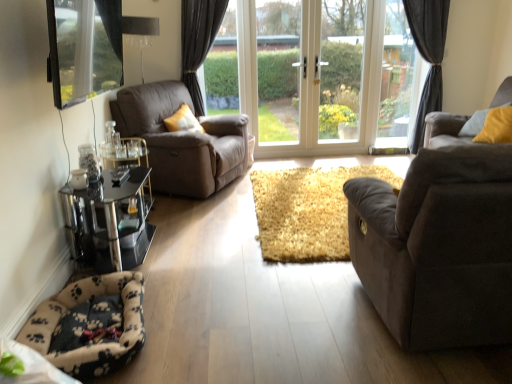
Question: From a real-world perspective, relative to transparent glass window at upper left, is dark gray fabric curtain at upper right vertically above or below?

Choices:
 (A) above
 (B) below

Answer: (B)

Question: Considering the positions of dark gray fabric curtain at upper right and transparent glass window at upper left in the image, is dark gray fabric curtain at upper right taller or shorter than transparent glass window at upper left?

Choices:
 (A) short
 (B) tall

Answer: (B)

Question: Which object is the farthest from the dark gray fabric curtain at upper right?

Choices:
 (A) white glossy door at center
 (B) suede-like brown couch at right, marked as the first studio couch in a bottom-to-top arrangement
 (C) clear glass window at upper center, the 1th window frame in the right-to-left sequence
 (D) fluffy beige and black paw print cat bed at lower left, which ranks as the second cat bed in top-to-bottom order
 (E) matte brown leather armchair at left

Answer: (D)

Question: Which is farther from the fluffy beige and black paw print cat bed at lower left, which ranks as the first cat bed in front-to-back order?

Choices:
 (A) soft gray fabric couch at right, marked as the second studio couch in a bottom-to-top arrangement
 (B) dark gray fabric curtain at upper right
 (C) black glass table at lower left
 (D) white glass door at center, the 2th window frame in the right-to-left sequence
 (E) matte brown leather armchair at left

Answer: (B)